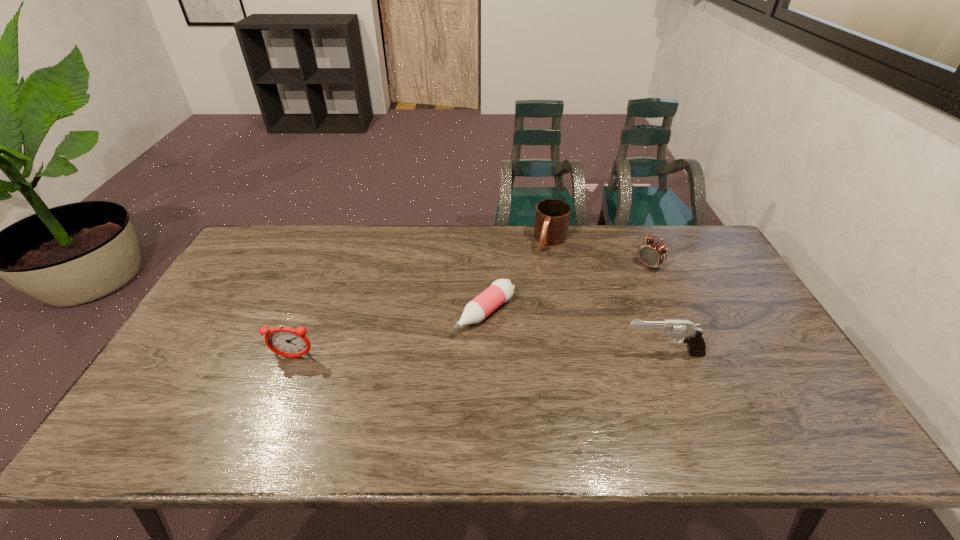
I want to click on vacant area in the image that satisfies the following two spatial constraints: 1. on the front side of the gun; 2. at the muzzle of the second object from left to right, so click(x=486, y=353).